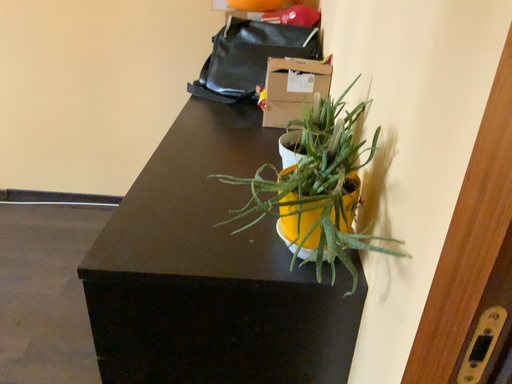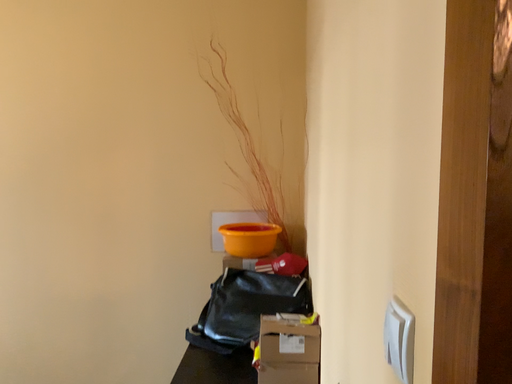
Question: Which way did the camera rotate in the video?

Choices:
 (A) rotated downward
 (B) rotated upward

Answer: (B)